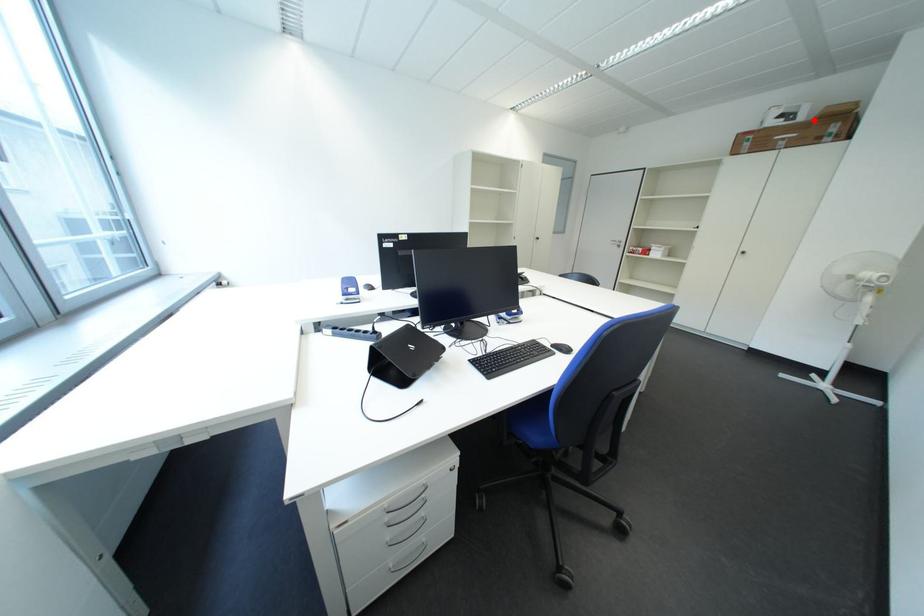
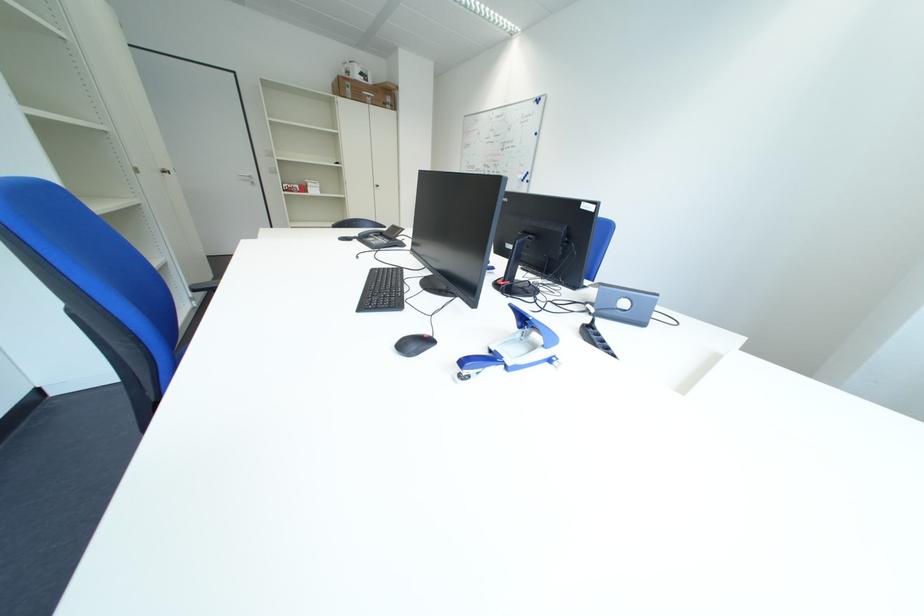
Locate, in the second image, the point that corresponds to the highlighted location in the first image.

(383, 84)